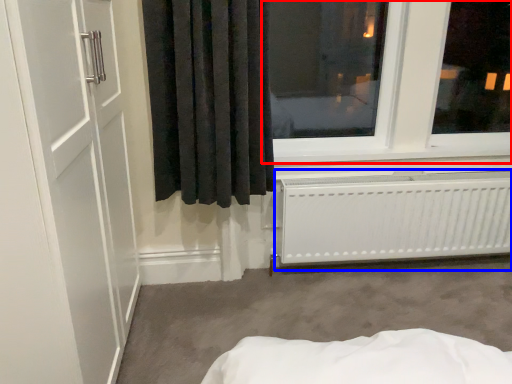
Question: Which point is further to the camera, window (highlighted by a red box) or radiator (highlighted by a blue box)?

Choices:
 (A) window
 (B) radiator

Answer: (B)